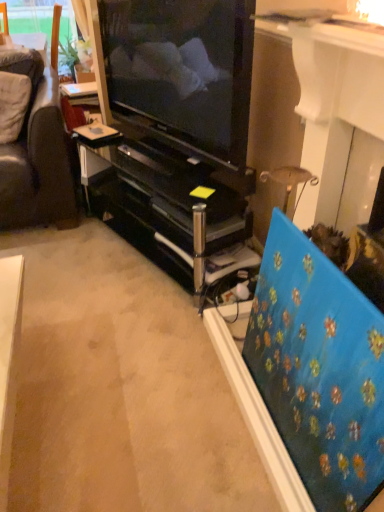
Question: Is black glossy tv cabinet at center positioned beyond the bounds of blue textured canvas at right?

Choices:
 (A) yes
 (B) no

Answer: (A)

Question: Does black glossy tv cabinet at center come behind blue textured canvas at right?

Choices:
 (A) no
 (B) yes

Answer: (B)

Question: Considering the relative positions of black glossy tv cabinet at center and blue textured canvas at right in the image provided, is black glossy tv cabinet at center to the left of blue textured canvas at right from the viewer's perspective?

Choices:
 (A) no
 (B) yes

Answer: (B)

Question: Can you confirm if black glossy tv cabinet at center is shorter than blue textured canvas at right?

Choices:
 (A) no
 (B) yes

Answer: (B)

Question: Can you confirm if black glossy tv cabinet at center is smaller than blue textured canvas at right?

Choices:
 (A) no
 (B) yes

Answer: (A)

Question: Choose the correct answer: Is black glossy tv cabinet at center inside blue textured canvas at right or outside it?

Choices:
 (A) outside
 (B) inside

Answer: (A)

Question: From a real-world perspective, is black glossy tv cabinet at center positioned above or below blue textured canvas at right?

Choices:
 (A) below
 (B) above

Answer: (A)

Question: From their relative heights in the image, would you say black glossy tv cabinet at center is taller or shorter than blue textured canvas at right?

Choices:
 (A) short
 (B) tall

Answer: (A)

Question: From the image's perspective, is black glossy tv cabinet at center positioned above or below blue textured canvas at right?

Choices:
 (A) below
 (B) above

Answer: (B)

Question: From the image's perspective, relative to blue textured canvas at right, is matte black television at center above or below?

Choices:
 (A) above
 (B) below

Answer: (A)

Question: Considering the positions of point (231, 7) and point (382, 429), is point (231, 7) closer or farther from the camera than point (382, 429)?

Choices:
 (A) farther
 (B) closer

Answer: (A)

Question: Is matte black television at center spatially inside blue textured canvas at right, or outside of it?

Choices:
 (A) outside
 (B) inside

Answer: (A)

Question: Visually, is matte black television at center positioned to the left or to the right of blue textured canvas at right?

Choices:
 (A) right
 (B) left

Answer: (B)

Question: From a real-world perspective, relative to black glossy tv cabinet at center, is blue textured canvas at right vertically above or below?

Choices:
 (A) below
 (B) above

Answer: (B)

Question: In the image, is blue textured canvas at right on the left side or the right side of black glossy tv cabinet at center?

Choices:
 (A) right
 (B) left

Answer: (A)